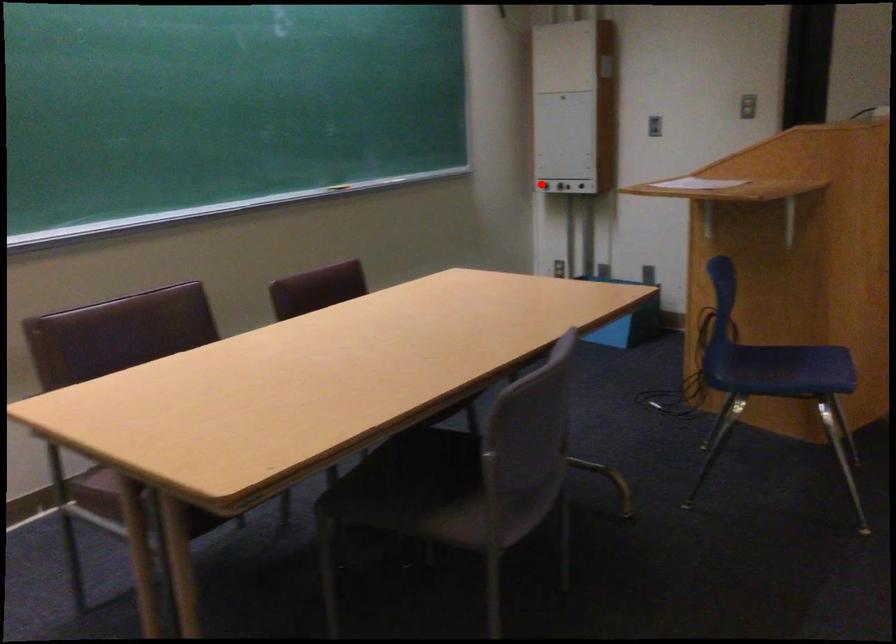
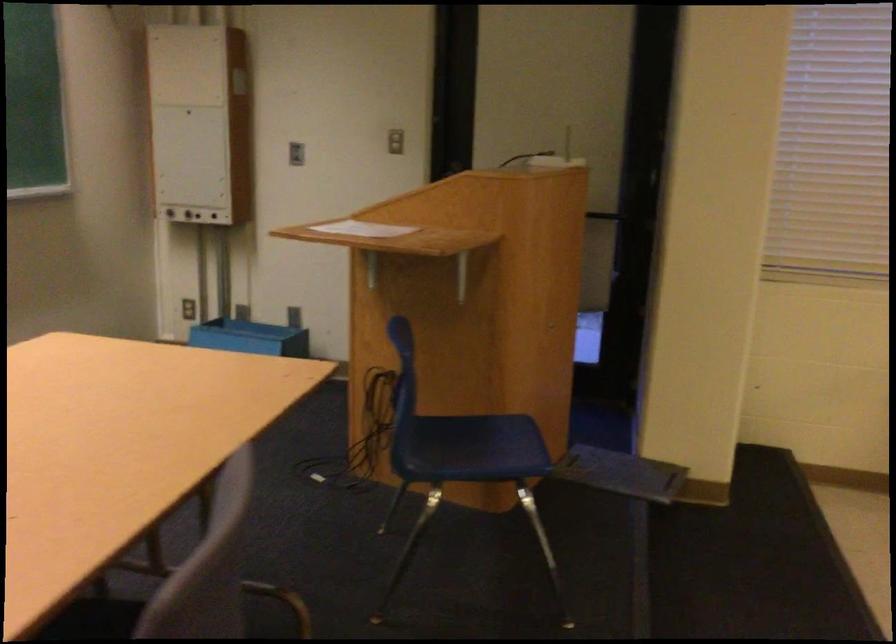
Question: I am providing you with two images of the same scene from different viewpoints. A red point is marked on the first image. Is the red point's position out of view in image 2?

Choices:
 (A) Yes
 (B) No

Answer: (B)